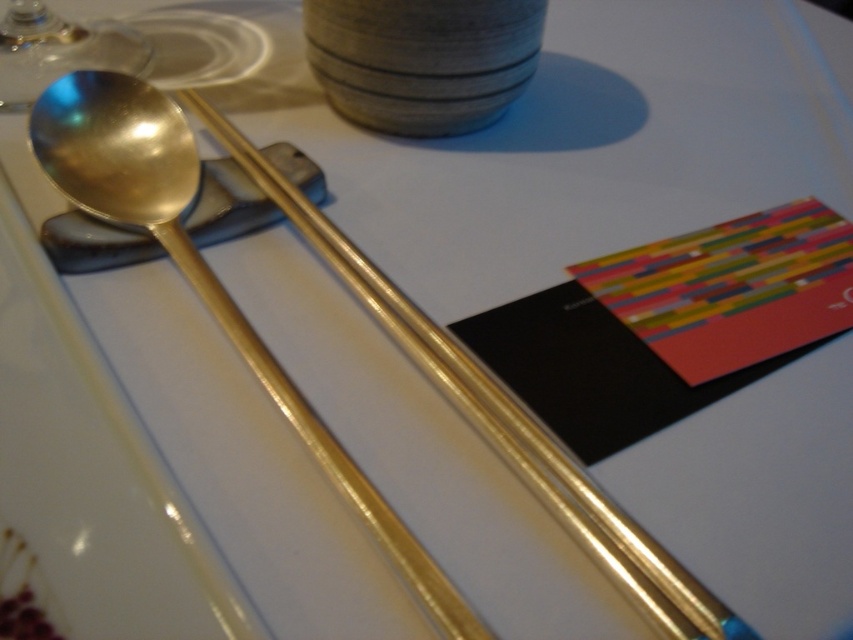
Question: Does gold shiny spoon at upper left have a lesser width compared to transparent glass at upper left?

Choices:
 (A) no
 (B) yes

Answer: (A)

Question: Which object is closer to the camera taking this photo?

Choices:
 (A) gold shiny spoon at upper left
 (B) transparent glass at upper left

Answer: (A)

Question: Is gold shiny spoon at upper left to the left of transparent glass at upper left from the viewer's perspective?

Choices:
 (A) yes
 (B) no

Answer: (B)

Question: Does gold shiny spoon at upper left come behind transparent glass at upper left?

Choices:
 (A) no
 (B) yes

Answer: (A)

Question: Which of the following is the farthest from the observer?

Choices:
 (A) transparent glass at upper left
 (B) gold shiny spoon at upper left

Answer: (A)